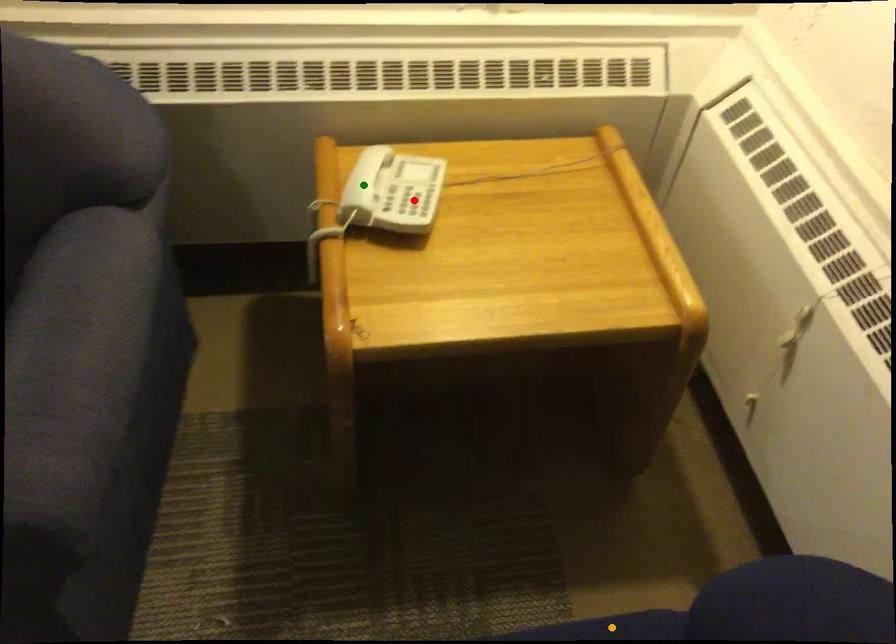
Order these from nearest to farthest:
green point, orange point, red point

orange point, red point, green point